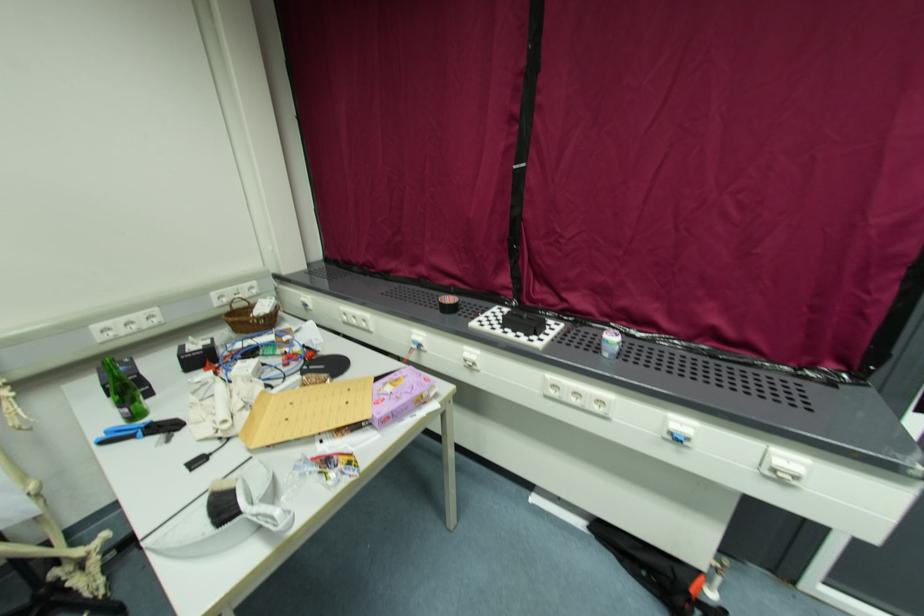
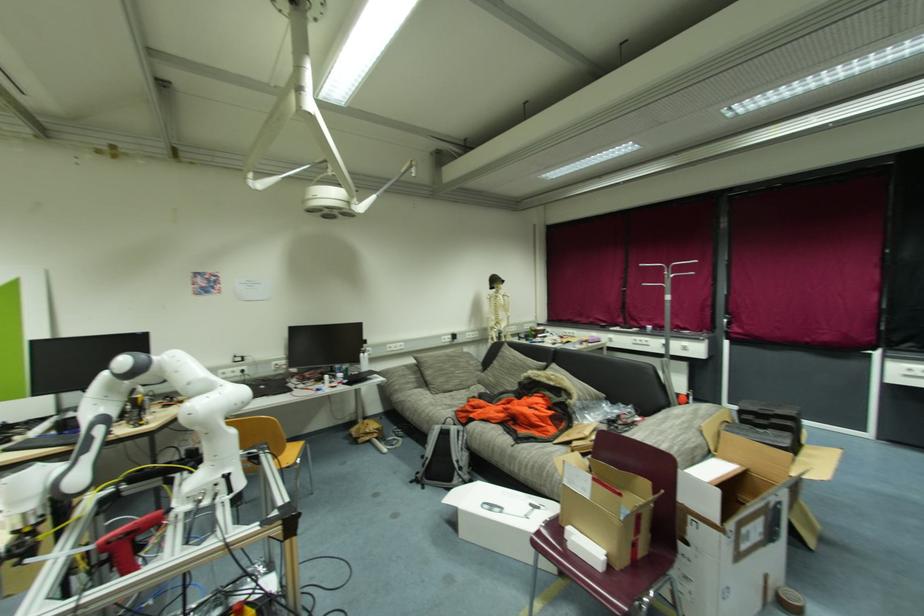
Question: Which direction would the cameraman need to move to produce the second image? Reply with the corresponding letter.

Choices:
 (A) Left
 (B) Right
 (C) Forward
 (D) Backward

Answer: (D)